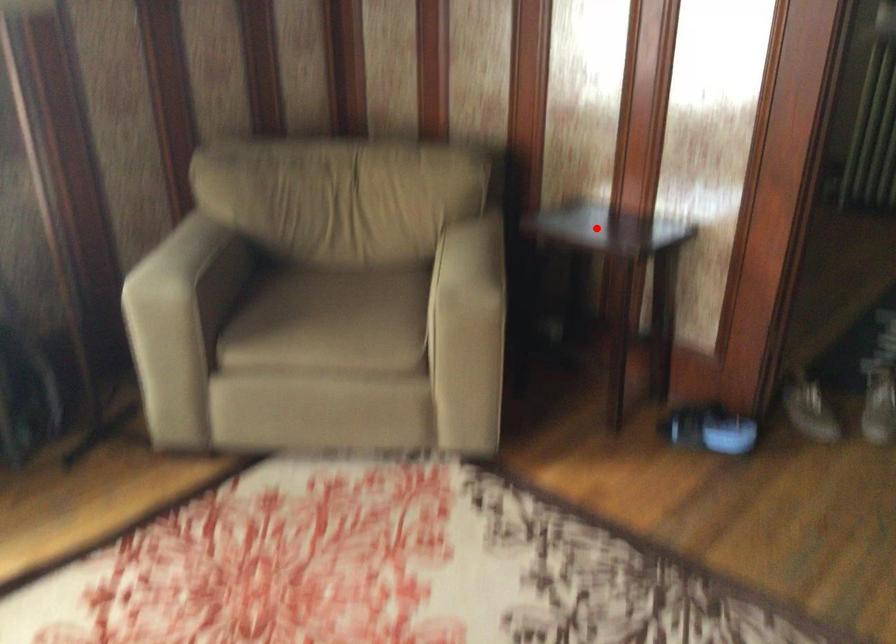
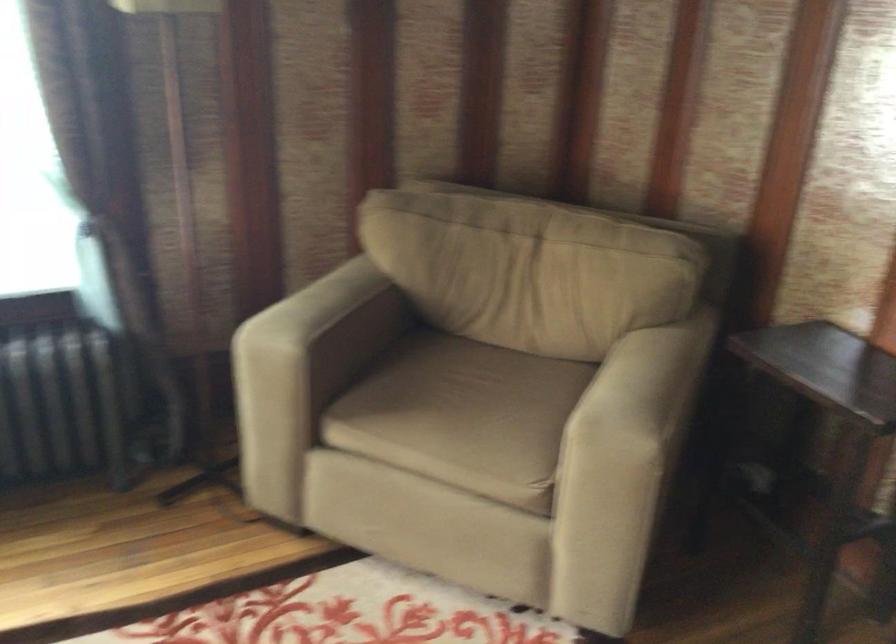
Question: I am providing you with two images of the same scene from different viewpoints. A red point is shown in image1. For the corresponding object point in image2, is it positioned nearer or farther from the camera?

Choices:
 (A) Nearer
 (B) Farther

Answer: (A)